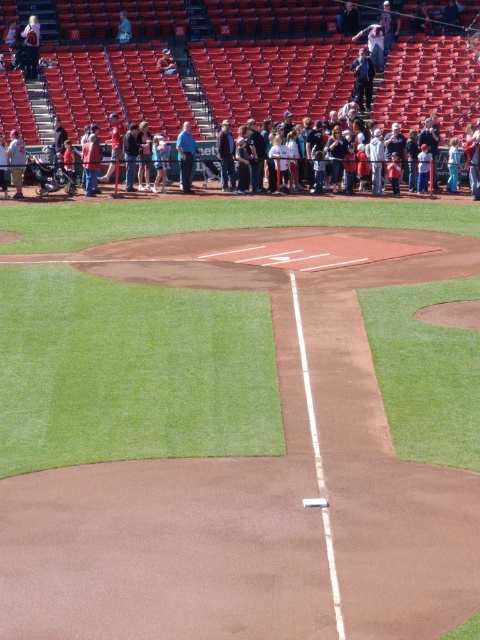
Question: Is dark blue shirt at center bigger than denim jacket at center?

Choices:
 (A) yes
 (B) no

Answer: (B)

Question: Which point is closer to the camera?

Choices:
 (A) (231, 168)
 (B) (263, 141)
 (C) (191, 172)

Answer: (C)

Question: Which object appears closest to the camera in this image?

Choices:
 (A) dark blue shirt at center
 (B) denim jacket at center

Answer: (B)

Question: Can you confirm if blue shirt at center is smaller than denim jacket at center?

Choices:
 (A) yes
 (B) no

Answer: (B)

Question: Can you confirm if dark blue shirt at center is wider than denim jacket at center?

Choices:
 (A) yes
 (B) no

Answer: (A)

Question: Estimate the real-world distances between objects in this image. Which object is closer to the dark blue shirt at center?

Choices:
 (A) blue shirt at center
 (B) denim jacket at center

Answer: (B)